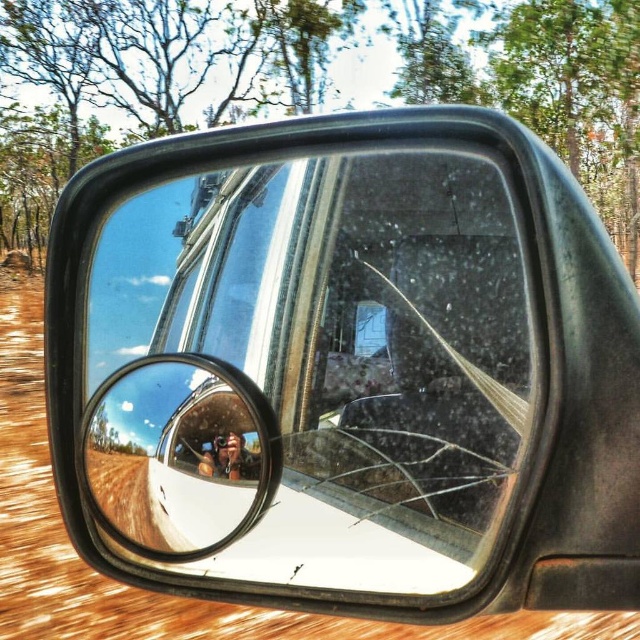
Question: Can you confirm if clear glass convex mirror at center is bigger than metallic silver camera at center?

Choices:
 (A) yes
 (B) no

Answer: (A)

Question: Which object is farther from the camera taking this photo?

Choices:
 (A) metallic silver camera at center
 (B) clear glass convex mirror at center

Answer: (A)

Question: Does clear glass convex mirror at center come in front of metallic silver camera at center?

Choices:
 (A) yes
 (B) no

Answer: (A)

Question: Observing the image, what is the correct spatial positioning of clear glass convex mirror at center in reference to metallic silver camera at center?

Choices:
 (A) below
 (B) above

Answer: (A)

Question: Which point is closer to the camera taking this photo?

Choices:
 (A) (218, 440)
 (B) (218, 436)

Answer: (B)